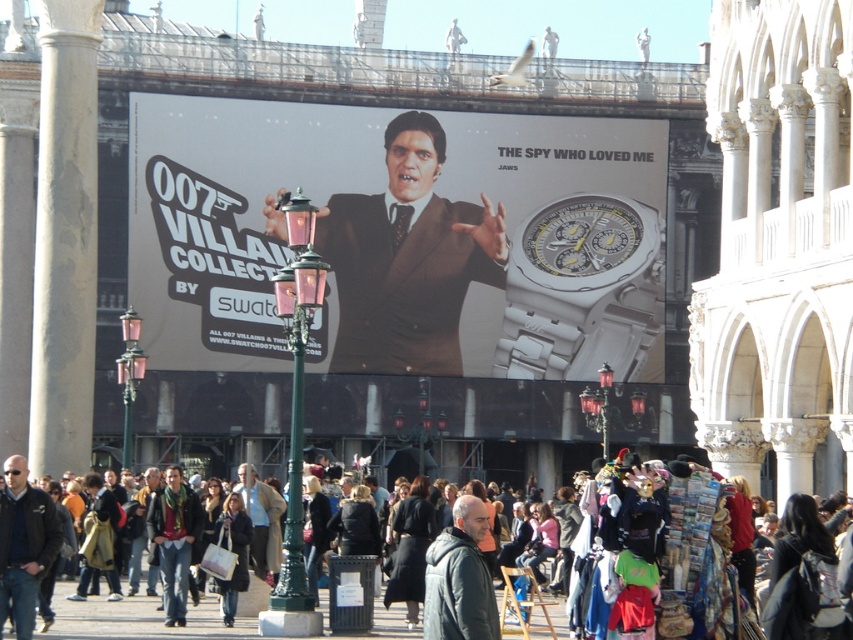
Question: Can you confirm if dark blue leather jacket at lower left is positioned below green knitted scarf at center?

Choices:
 (A) yes
 (B) no

Answer: (B)

Question: Which point is closer to the camera?

Choices:
 (A) green knitted scarf at center
 (B) gray stone column at left
 (C) dark blue leather jacket at lower left
 (D) white metallic watch at center

Answer: (C)

Question: Which of the following is the farthest from the observer?

Choices:
 (A) (352, 488)
 (B) (55, 449)

Answer: (B)

Question: Is dark brown leather jacket at center further to the viewer compared to dark gray jacket at center?

Choices:
 (A) yes
 (B) no

Answer: (A)

Question: Can you confirm if dark brown leather jacket at center is wider than dark blue leather jacket at lower left?

Choices:
 (A) yes
 (B) no

Answer: (A)

Question: Which point appears farthest from the camera in this image?

Choices:
 (A) (405, 284)
 (B) (131, 563)
 (C) (129, 481)
 (D) (0, 632)

Answer: (A)